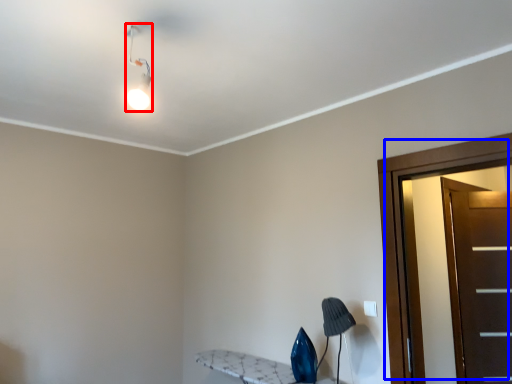
Question: Which object appears farthest to the camera in this image, light fixture (highlighted by a red box) or door (highlighted by a blue box)?

Choices:
 (A) light fixture
 (B) door

Answer: (B)